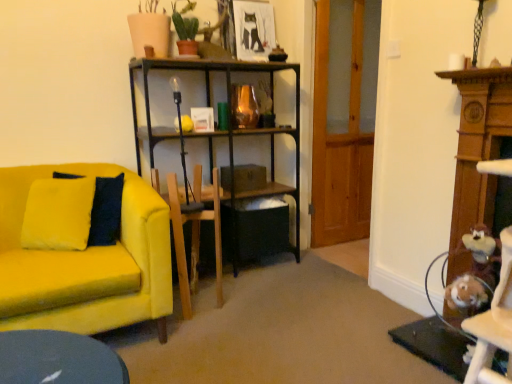
Where is `matte black picture frame at upper center`? The width and height of the screenshot is (512, 384). matte black picture frame at upper center is located at coordinates (254, 30).

Identify the location of matte black picture frame at upper center. The height and width of the screenshot is (384, 512). (254, 30).

In terms of height, does velvet yellow couch at left look taller or shorter compared to transparent wooden door at center?

In the image, velvet yellow couch at left appears to be shorter than transparent wooden door at center.

Does point (75, 330) appear closer or farther from the camera than point (345, 165)?

Point (75, 330).

Considering the positions of objects velvet yellow couch at left and transparent wooden door at center in the image provided, who is more to the right, velvet yellow couch at left or transparent wooden door at center?

transparent wooden door at center.

Is velvet yellow couch at left not close to transparent wooden door at center?

Indeed, velvet yellow couch at left is not near transparent wooden door at center.

Between matte black picture frame at upper center and wooden swivel chair at center, which one has larger size?

With larger size is wooden swivel chair at center.

Do you think matte black picture frame at upper center is within wooden swivel chair at center, or outside of it?

matte black picture frame at upper center is located beyond the bounds of wooden swivel chair at center.

Does matte black picture frame at upper center have a greater width compared to wooden swivel chair at center?

No.

In the scene shown: Based on their positions, is matte black picture frame at upper center located to the left or right of wooden swivel chair at center?

Clearly, matte black picture frame at upper center is on the right of wooden swivel chair at center in the image.

Which of these two, transparent wooden door at center or matte black picture frame at upper center, stands shorter?

matte black picture frame at upper center is shorter.

Who is more distant, transparent wooden door at center or matte black picture frame at upper center?

matte black picture frame at upper center is behind.

How different are the orientations of wooden swivel chair at center and matte black picture frame at upper center in degrees?

wooden swivel chair at center and matte black picture frame at upper center are facing 9.9 degrees away from each other.

Does wooden swivel chair at center have a greater width compared to matte black picture frame at upper center?

Correct, the width of wooden swivel chair at center exceeds that of matte black picture frame at upper center.

Is wooden swivel chair at center smaller than matte black picture frame at upper center?

No.

Who is shorter, wooden swivel chair at center or matte black picture frame at upper center?

matte black picture frame at upper center is shorter.

Which object is thinner, velvet yellow couch at left or matte black picture frame at upper center?

Thinner between the two is matte black picture frame at upper center.

From a real-world perspective, which is physically above, velvet yellow couch at left or matte black picture frame at upper center?

In real-world perspective, matte black picture frame at upper center is above.

From the picture: Which is behind, velvet yellow couch at left or matte black picture frame at upper center?

matte black picture frame at upper center.

From their relative heights in the image, would you say velvet yellow couch at left is taller or shorter than matte black picture frame at upper center?

Considering their sizes, velvet yellow couch at left has more height than matte black picture frame at upper center.

Locate an element on the screen. This screenshot has height=384, width=512. glass door behind the velvet yellow couch at left is located at coordinates (344, 118).

Between transparent wooden door at center and velvet yellow couch at left, which one has more height?

Standing taller between the two is transparent wooden door at center.

Considering the sizes of objects transparent wooden door at center and velvet yellow couch at left in the image provided, who is wider, transparent wooden door at center or velvet yellow couch at left?

velvet yellow couch at left.

Looking at this image, is transparent wooden door at center not within velvet yellow couch at left?

Yes.

Is point (198, 186) positioned in front of point (364, 28)?

Yes.

Is wooden swivel chair at center not close to transparent wooden door at center?

wooden swivel chair at center is positioned a significant distance from transparent wooden door at center.

Which is in front, wooden swivel chair at center or transparent wooden door at center?

Positioned in front is wooden swivel chair at center.

Between wooden swivel chair at center and transparent wooden door at center, which one has smaller size?

Smaller between the two is wooden swivel chair at center.

The height and width of the screenshot is (384, 512). I want to click on studio couch in front of the transparent wooden door at center, so click(86, 262).

Locate an element on the screen. swivel chair that appears below the matte black picture frame at upper center (from a real-world perspective) is located at coordinates pos(195,234).

Looking at the image, which one is located closer to matte black picture frame at upper center, wooden swivel chair at center or velvet yellow couch at left?

Among the two, wooden swivel chair at center is located nearer to matte black picture frame at upper center.

From the image, which object appears to be nearer to transparent wooden door at center, wooden swivel chair at center or matte black picture frame at upper center?

matte black picture frame at upper center lies closer to transparent wooden door at center than the other object.

Consider the image. Estimate the real-world distances between objects in this image. Which object is closer to velvet yellow couch at left, wooden swivel chair at center or transparent wooden door at center?

Among the two, wooden swivel chair at center is located nearer to velvet yellow couch at left.

Looking at this image, based on their spatial positions, is transparent wooden door at center or velvet yellow couch at left closer to wooden swivel chair at center?

velvet yellow couch at left lies closer to wooden swivel chair at center than the other object.

From the image, which object appears to be nearer to matte black picture frame at upper center, wooden swivel chair at center or transparent wooden door at center?

The object closer to matte black picture frame at upper center is transparent wooden door at center.

Considering their positions, is matte black picture frame at upper center positioned closer to wooden swivel chair at center than transparent wooden door at center?

matte black picture frame at upper center.

Based on the photo, based on their spatial positions, is velvet yellow couch at left or transparent wooden door at center closer to wooden swivel chair at center?

Among the two, velvet yellow couch at left is located nearer to wooden swivel chair at center.

Considering their positions, is transparent wooden door at center positioned further to velvet yellow couch at left than matte black picture frame at upper center?

The object further to velvet yellow couch at left is transparent wooden door at center.

Locate an element on the screen. This screenshot has width=512, height=384. swivel chair between matte black picture frame at upper center and velvet yellow couch at left from top to bottom is located at coordinates (195, 234).

Image resolution: width=512 pixels, height=384 pixels. Find the location of `glass door between matte black picture frame at upper center and wooden swivel chair at center vertically`. glass door between matte black picture frame at upper center and wooden swivel chair at center vertically is located at coordinates (344, 118).

At what (x,y) coordinates should I click in order to perform the action: click on picture frame between velvet yellow couch at left and transparent wooden door at center from left to right. Please return your answer as a coordinate pair (x, y). This screenshot has width=512, height=384. Looking at the image, I should click on (254, 30).

Find the location of a particular element. This screenshot has height=384, width=512. swivel chair located between velvet yellow couch at left and transparent wooden door at center in the left-right direction is located at coordinates (195, 234).